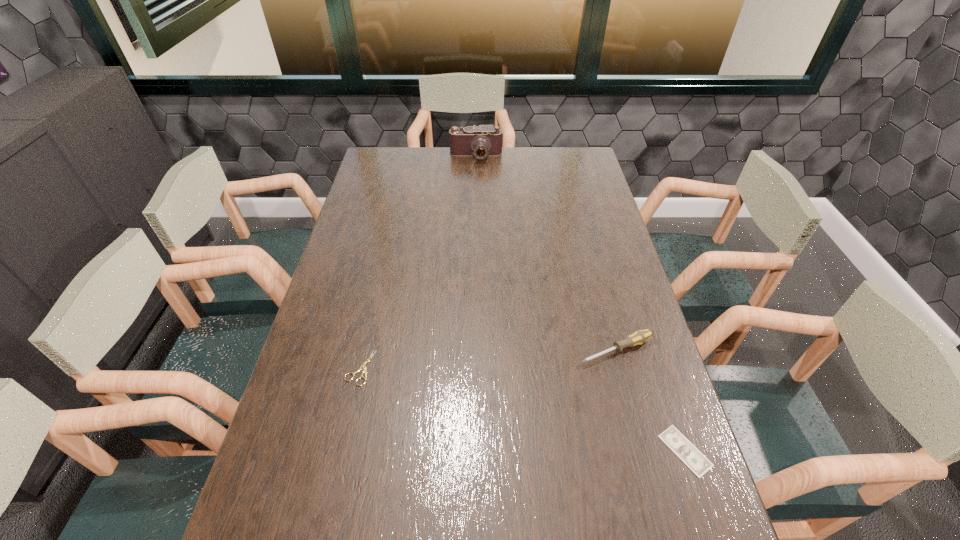
Locate an element on the screen. The image size is (960, 540). vacant space on the desktop that is between the second shortest object and the shortest object and is positioned on the front-facing side of the tallest object is located at coordinates (472, 396).

Image resolution: width=960 pixels, height=540 pixels. Find the location of `vacant spot on the desktop that is between the shears and the shortest object and is positioned at the tip of the screwdriver`. vacant spot on the desktop that is between the shears and the shortest object and is positioned at the tip of the screwdriver is located at coordinates (493, 402).